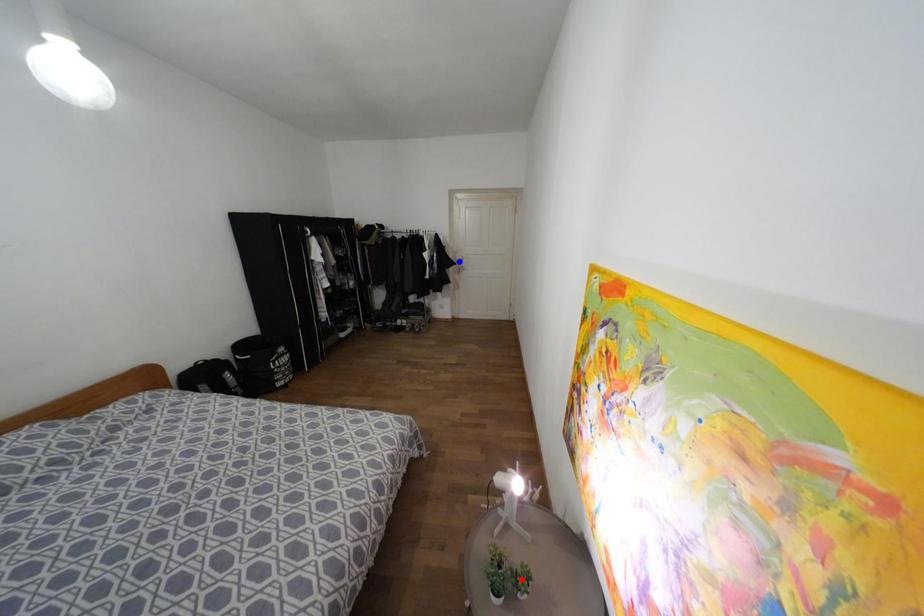
Question: In the image, two points are highlighted. Which point is nearer to the camera? Reply with the corresponding letter.

Choices:
 (A) blue point
 (B) red point

Answer: (B)